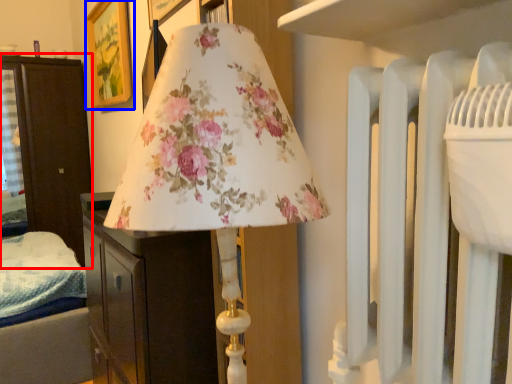
Question: Which point is closer to the camera, furniture (highlighted by a red box) or picture frame (highlighted by a blue box)?

Choices:
 (A) furniture
 (B) picture frame

Answer: (B)